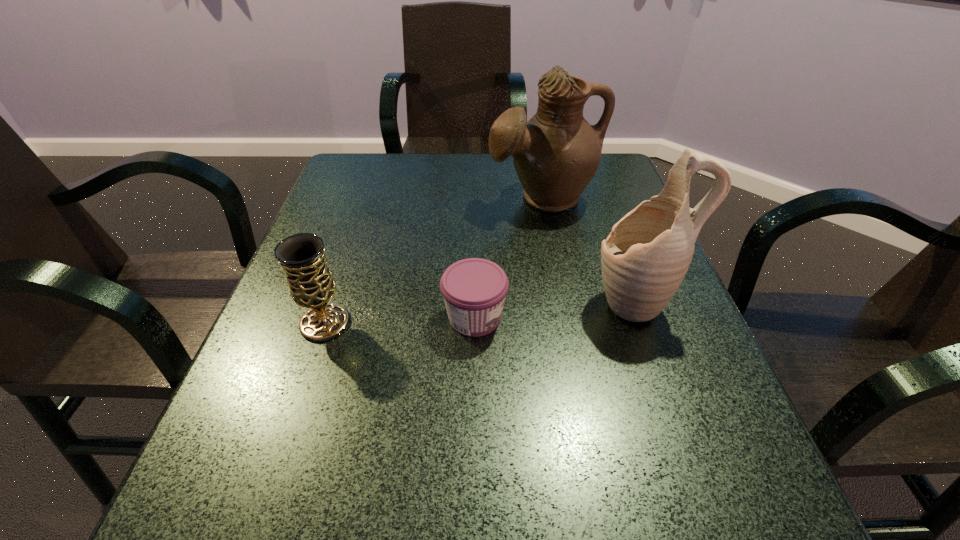
Find the location of a particular element. This screenshot has width=960, height=540. free space between the nearer pitcher and the farthest object is located at coordinates (588, 250).

Image resolution: width=960 pixels, height=540 pixels. I want to click on free space between the nearer pitcher and the farther pitcher, so click(x=588, y=250).

Locate an element on the screen. vacant region between the chalice and the farthest object is located at coordinates (434, 260).

Where is `vacant region between the shortest object and the nearer pitcher`? Image resolution: width=960 pixels, height=540 pixels. vacant region between the shortest object and the nearer pitcher is located at coordinates (555, 310).

Where is `vacant space that's between the farther pitcher and the leftmost object`? vacant space that's between the farther pitcher and the leftmost object is located at coordinates (434, 260).

Identify the location of unoccupied area between the jam and the nearer pitcher. The height and width of the screenshot is (540, 960). (555, 310).

This screenshot has height=540, width=960. I want to click on blank region between the farther pitcher and the jam, so click(509, 258).

Locate an element on the screen. This screenshot has width=960, height=540. the third closest object to the nearer pitcher is located at coordinates (311, 284).

Locate which object is the closest to the shortest object. Please provide its 2D coordinates. Your answer should be formatted as a tuple, i.e. [(x, y)], where the tuple contains the x and y coordinates of a point satisfying the conditions above.

[(644, 259)]

You are a GUI agent. You are given a task and a screenshot of the screen. Output one action in this format:
    pyautogui.click(x=<x>, y=<y>)
    Task: Click on the free space that satisfies the following two spatial constraints: 1. at the spout of the nearer pitcher; 2. on the front side of the chalice
    
    Given the screenshot: What is the action you would take?
    pyautogui.click(x=642, y=323)